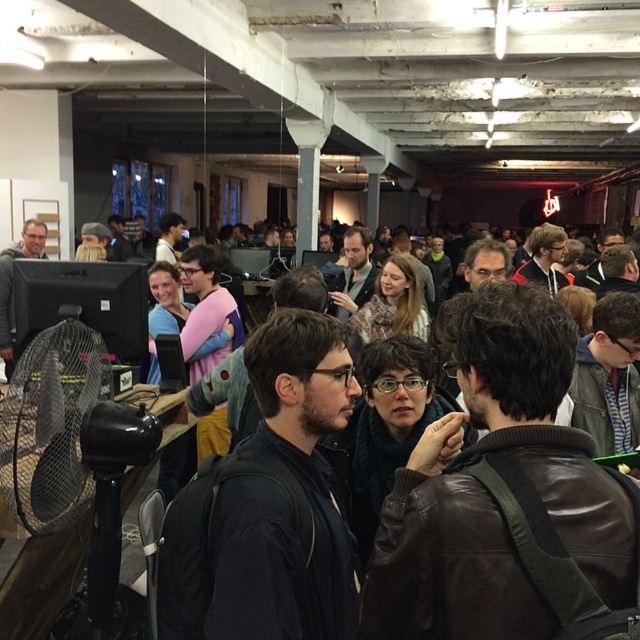
Is leather jacket at center positioned at the back of black plastic fan at left?

No, it is in front of black plastic fan at left.

This screenshot has width=640, height=640. What do you see at coordinates (506, 499) in the screenshot? I see `leather jacket at center` at bounding box center [506, 499].

Describe the element at coordinates (506, 499) in the screenshot. I see `leather jacket at center` at that location.

The height and width of the screenshot is (640, 640). What are the coordinates of `leather jacket at center` in the screenshot? It's located at (506, 499).

Is metallic grid fan at lower left thinner than matte black monitor at left?

Indeed, metallic grid fan at lower left has a lesser width compared to matte black monitor at left.

Between metallic grid fan at lower left and matte black monitor at left, which one is positioned lower?

metallic grid fan at lower left

This screenshot has width=640, height=640. Find the location of `metallic grid fan at lower left`. metallic grid fan at lower left is located at coordinates (51, 426).

Where is `metallic grid fan at lower left`? The image size is (640, 640). metallic grid fan at lower left is located at coordinates (51, 426).

Does matte black jacket at center have a larger size compared to metallic grid fan at lower left?

Yes, matte black jacket at center is bigger than metallic grid fan at lower left.

Locate an element on the screen. This screenshot has width=640, height=640. matte black jacket at center is located at coordinates (492, 490).